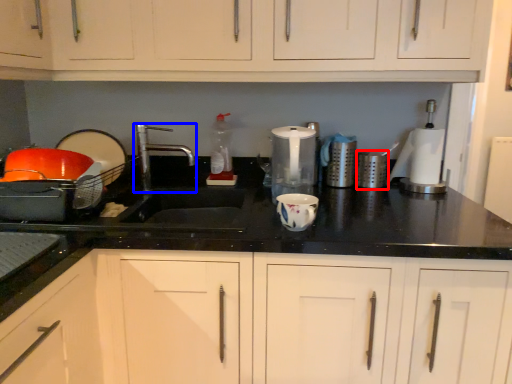
Question: Which object appears closest to the camera in this image, appliance (highlighted by a red box) or tap (highlighted by a blue box)?

Choices:
 (A) appliance
 (B) tap

Answer: (B)